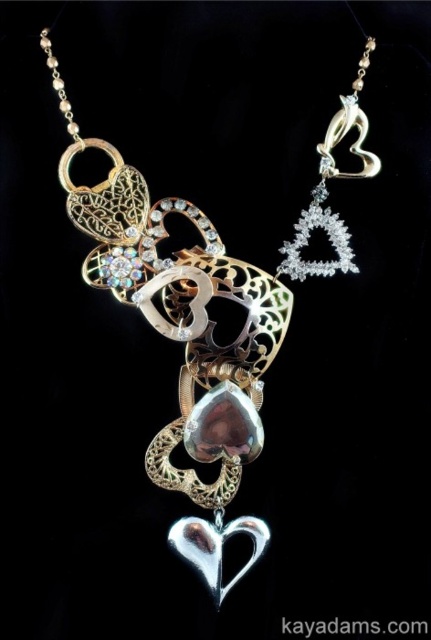
Question: Which object is farther from the camera taking this photo?

Choices:
 (A) shiny silver heart at center
 (B) clear crystal triangle at upper center

Answer: (A)

Question: Does clear crystal triangle at upper center have a larger size compared to shiny silver heart at center?

Choices:
 (A) yes
 (B) no

Answer: (A)

Question: Is clear crystal triangle at upper center above shiny silver heart at center?

Choices:
 (A) no
 (B) yes

Answer: (B)

Question: Does silver metallic heart at center have a larger size compared to clear crystal triangle at upper center?

Choices:
 (A) yes
 (B) no

Answer: (A)

Question: Among these objects, which one is farthest from the camera?

Choices:
 (A) silver metallic heart at center
 (B) shiny silver heart at center

Answer: (B)

Question: Which object is closer to the camera taking this photo?

Choices:
 (A) silver metallic heart at center
 (B) clear crystal triangle at upper center

Answer: (A)